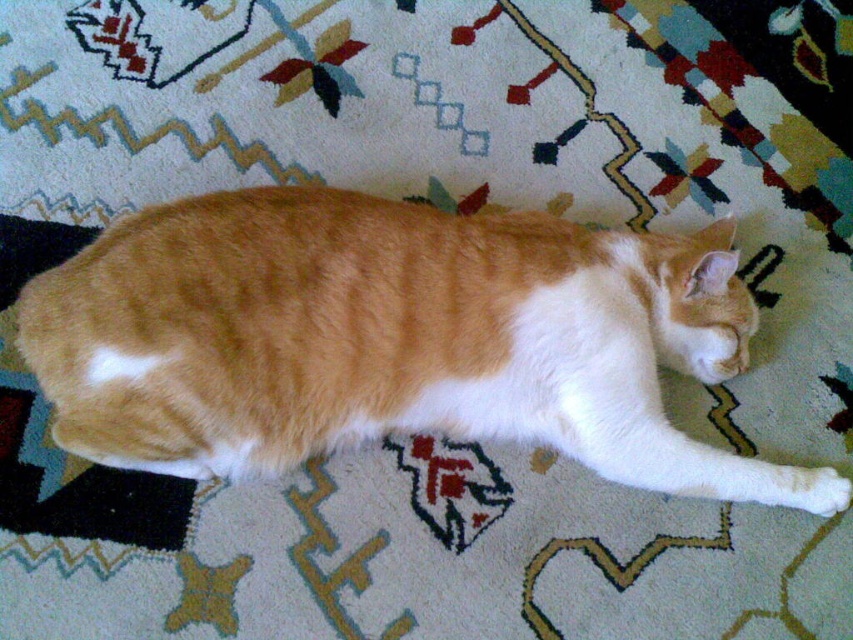
You are an animal behaviorist observing the orange tabby cat at center. Based on its position on the rug, can you determine if it is closer to the edge of the rug or centered?

The orange tabby cat at center is located at point coordinates that are close to the center of the rug, so it is more centered than near the edge.